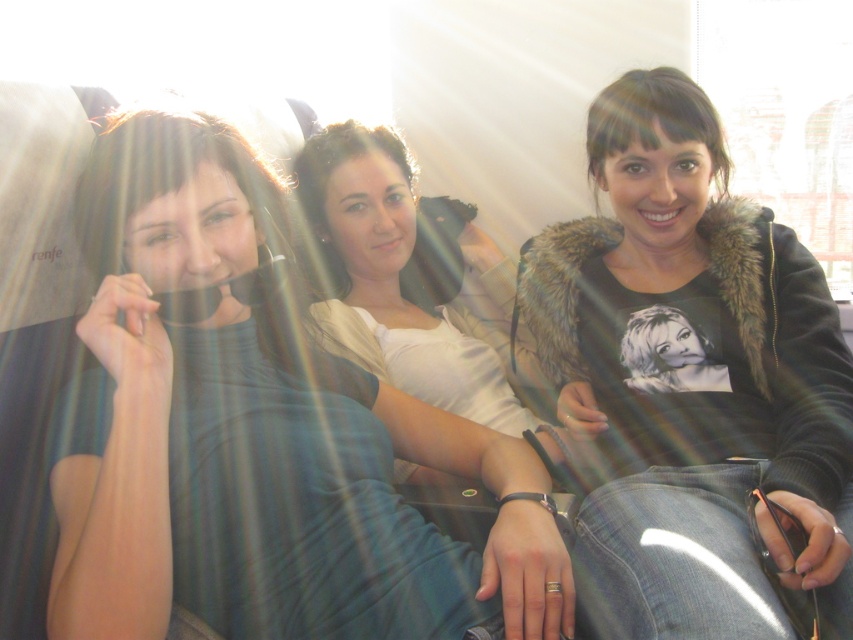
You are a photographer trying to capture a candid shot of the matte black shirt at left and the fuzzy black jacket at center in the train carriage. Which of the two objects would appear smaller in your photo?

The matte black shirt at left appears smaller in the photo because it is not as tall as the fuzzy black jacket at center.

You are a photographer trying to capture a candid shot of the two people at the center of the scene. Since you want to ensure both the fuzzy black jacket at center and the white satin shirt at center are clearly visible in the photo, which clothing item should you focus on to make sure both are in focus?

The fuzzy black jacket at center is bigger than the white satin shirt at center. Therefore, focusing on the fuzzy black jacket at center will ensure both are in focus as it is larger and covers more area, making it easier to capture both details.